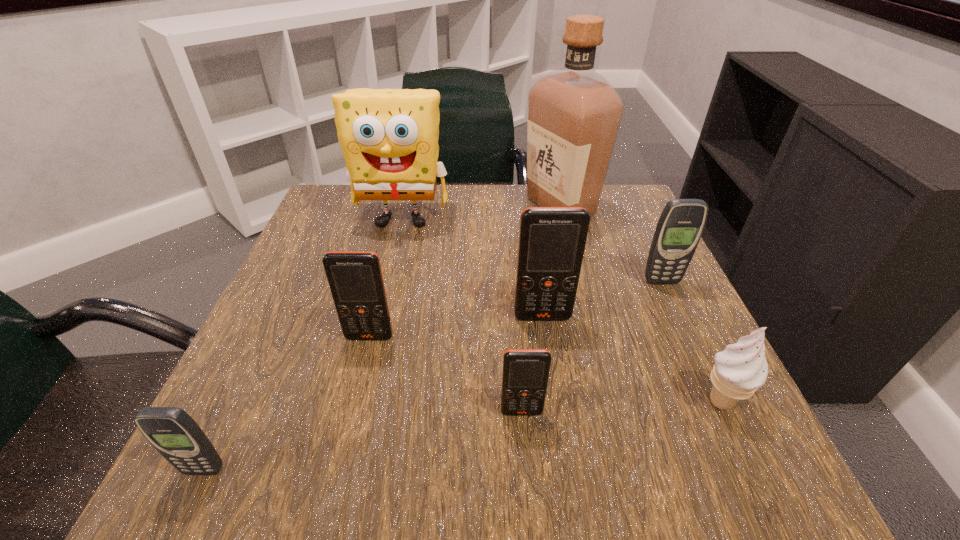
Where is `icecream`? The width and height of the screenshot is (960, 540). icecream is located at coordinates [739, 370].

Identify the location of the nearest orange cellular telephone. (525, 375).

Locate an element on the screen. The height and width of the screenshot is (540, 960). the fourth farthest cellular telephone is located at coordinates (525, 375).

Locate an element on the screen. This screenshot has height=540, width=960. the nearest object is located at coordinates (173, 433).

This screenshot has width=960, height=540. Find the location of `the nearest cellular telephone`. the nearest cellular telephone is located at coordinates (173, 433).

Where is `vacant space located on the front-facing side of the brown liquor`? The height and width of the screenshot is (540, 960). vacant space located on the front-facing side of the brown liquor is located at coordinates (372, 206).

Find the location of a particular element. blank area located on the front-facing side of the brown liquor is located at coordinates (464, 206).

At what (x,y) coordinates should I click in order to perform the action: click on vacant space located on the front-facing side of the brown liquor. Please return your answer as a coordinate pair (x, y). The image size is (960, 540). Looking at the image, I should click on (405, 206).

At what (x,y) coordinates should I click in order to perform the action: click on vacant space positioned on the face of the seventh shortest object. Please return your answer as a coordinate pair (x, y). Looking at the image, I should click on (390, 273).

In order to click on vacant region located on the screen of the tallest cellular telephone in this screenshot , I will do `click(564, 461)`.